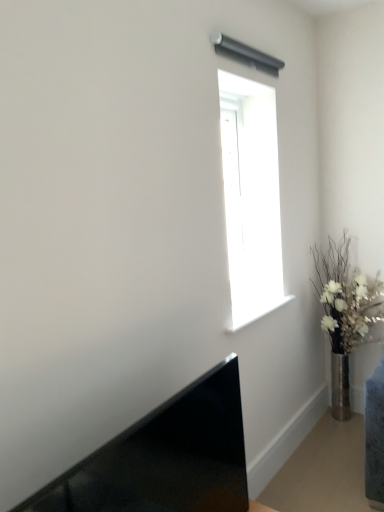
Describe the element at coordinates (345, 313) in the screenshot. The image size is (384, 512). I see `silver metallic vase at right` at that location.

At what (x,y) coordinates should I click in order to perform the action: click on silver metallic vase at right. Please return your answer as a coordinate pair (x, y). The height and width of the screenshot is (512, 384). Looking at the image, I should click on (345, 313).

Which object is further away from the camera, silver metallic vase at right or transparent glass window at upper center?

silver metallic vase at right is more distant.

Is silver metallic vase at right at the right side of transparent glass window at upper center?

Yes, silver metallic vase at right is to the right of transparent glass window at upper center.

Measure the distance from silver metallic vase at right to transparent glass window at upper center.

They are 27.99 inches apart.

The height and width of the screenshot is (512, 384). In order to click on window to the left of silver metallic vase at right in this screenshot , I will do `click(251, 197)`.

Considering the relative sizes of transparent glass window at upper center and matte black laptop at lower left in the image provided, is transparent glass window at upper center thinner than matte black laptop at lower left?

No.

In the image, is transparent glass window at upper center positioned in front of or behind matte black laptop at lower left?

transparent glass window at upper center is positioned farther from the viewer than matte black laptop at lower left.

The height and width of the screenshot is (512, 384). In order to click on laptop below the transparent glass window at upper center (from the image's perspective) in this screenshot , I will do `click(165, 458)`.

Between transparent glass window at upper center and matte black laptop at lower left, which one appears on the left side from the viewer's perspective?

Positioned to the left is matte black laptop at lower left.

Is matte black laptop at lower left thinner than silver metallic vase at right?

Correct, the width of matte black laptop at lower left is less than that of silver metallic vase at right.

How much distance is there between matte black laptop at lower left and silver metallic vase at right?

They are 1.57 meters apart.

Is silver metallic vase at right at the back of matte black laptop at lower left?

That's not correct — matte black laptop at lower left is not looking away from silver metallic vase at right.

Considering the sizes of matte black laptop at lower left and silver metallic vase at right in the image, is matte black laptop at lower left bigger or smaller than silver metallic vase at right?

Considering their sizes, matte black laptop at lower left takes up less space than silver metallic vase at right.

Between transparent glass window at upper center and silver metallic vase at right, which one has larger size?

silver metallic vase at right is bigger.

Who is more distant, transparent glass window at upper center or silver metallic vase at right?

silver metallic vase at right is further from the camera.

Is transparent glass window at upper center positioned beyond the bounds of silver metallic vase at right?

transparent glass window at upper center lies outside silver metallic vase at right's area.

Does matte black laptop at lower left have a smaller size compared to transparent glass window at upper center?

Correct, matte black laptop at lower left occupies less space than transparent glass window at upper center.

This screenshot has width=384, height=512. Find the location of `window above the matte black laptop at lower left (from a real-world perspective)`. window above the matte black laptop at lower left (from a real-world perspective) is located at coordinates (251, 197).

How many degrees apart are the facing directions of matte black laptop at lower left and transparent glass window at upper center?

The angular difference between matte black laptop at lower left and transparent glass window at upper center is 1.71 degrees.

Which object is closer to the camera taking this photo, matte black laptop at lower left or transparent glass window at upper center?

matte black laptop at lower left is in front.

Who is taller, silver metallic vase at right or matte black laptop at lower left?

With more height is silver metallic vase at right.

How different are the orientations of silver metallic vase at right and matte black laptop at lower left in degrees?

They differ by 92 degrees in their facing directions.

Which is less distant, (364, 304) or (143, 473)?

The point (143, 473) is in front.

Which object is further away from the camera taking this photo, silver metallic vase at right or matte black laptop at lower left?

silver metallic vase at right is behind.

Identify the location of window located in front of the silver metallic vase at right. (251, 197).

The width and height of the screenshot is (384, 512). Identify the location of laptop on the left of transparent glass window at upper center. (165, 458).

Which object lies further to the anchor point matte black laptop at lower left, silver metallic vase at right or transparent glass window at upper center?

silver metallic vase at right is further to matte black laptop at lower left.

Looking at the image, which one is located further to matte black laptop at lower left, transparent glass window at upper center or silver metallic vase at right?

silver metallic vase at right is positioned further to the anchor matte black laptop at lower left.

From the image, which object appears to be nearer to silver metallic vase at right, transparent glass window at upper center or matte black laptop at lower left?

Based on the image, transparent glass window at upper center appears to be nearer to silver metallic vase at right.

Which object lies further to the anchor point transparent glass window at upper center, silver metallic vase at right or matte black laptop at lower left?

matte black laptop at lower left is further to transparent glass window at upper center.

When comparing their distances from silver metallic vase at right, does matte black laptop at lower left or transparent glass window at upper center seem closer?

transparent glass window at upper center.

Looking at the image, which one is located closer to transparent glass window at upper center, matte black laptop at lower left or silver metallic vase at right?

silver metallic vase at right lies closer to transparent glass window at upper center than the other object.

Where is `window between matte black laptop at lower left and silver metallic vase at right in the front-back direction`? window between matte black laptop at lower left and silver metallic vase at right in the front-back direction is located at coordinates (251, 197).